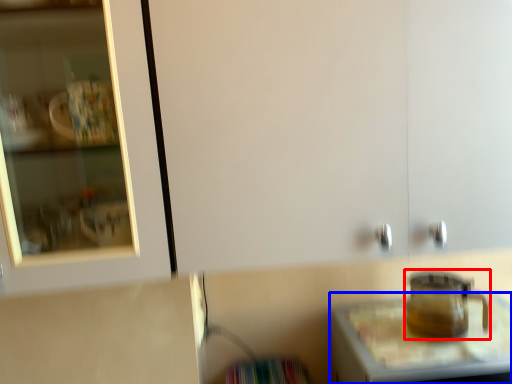
Question: Which of the following is the farthest to the observer, appliance (highlighted by a red box) or table (highlighted by a blue box)?

Choices:
 (A) appliance
 (B) table

Answer: (A)